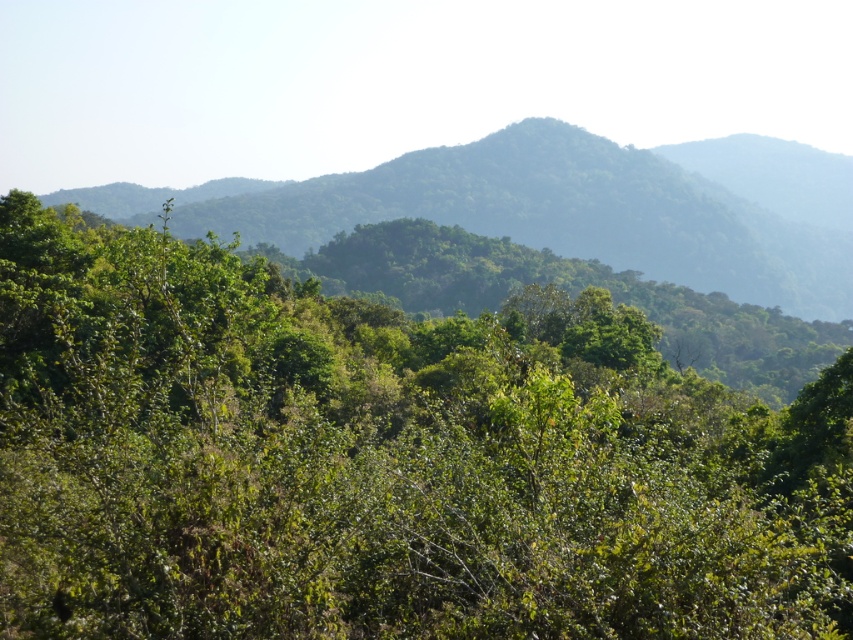
Is green leafy tree at center wider than green leafy mountain at center?

In fact, green leafy tree at center might be narrower than green leafy mountain at center.

Which is behind, point (231, 564) or point (482, 189)?

Positioned behind is point (482, 189).

You are a GUI agent. You are given a task and a screenshot of the screen. Output one action in this format:
    pyautogui.click(x=<x>, y=<y>)
    Task: Click on the green leafy tree at center
    Image resolution: width=853 pixels, height=640 pixels.
    Given the screenshot: What is the action you would take?
    pyautogui.click(x=384, y=461)